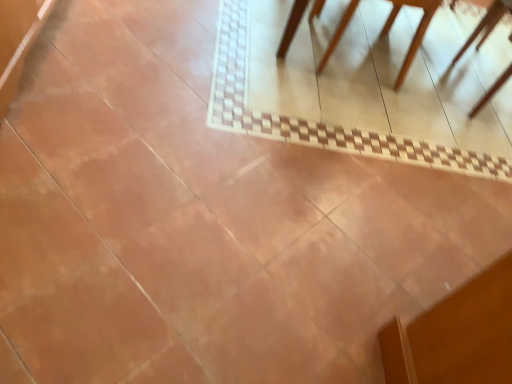
Question: From the image's perspective, is light brown wooden table at upper right positioned above or below brown wooden chair at upper right?

Choices:
 (A) below
 (B) above

Answer: (B)

Question: Is point (435, 6) positioned closer to the camera than point (501, 84)?

Choices:
 (A) farther
 (B) closer

Answer: (A)

Question: In terms of width, does light brown wooden table at upper right look wider or thinner when compared to brown wooden chair at upper right?

Choices:
 (A) thin
 (B) wide

Answer: (B)

Question: From the image's perspective, relative to light brown wooden table at upper right, is brown wooden chair at upper right above or below?

Choices:
 (A) above
 (B) below

Answer: (B)

Question: From a real-world perspective, is brown wooden chair at upper right physically located above or below light brown wooden table at upper right?

Choices:
 (A) below
 (B) above

Answer: (A)

Question: Considering their positions, is brown wooden chair at upper right located in front of or behind light brown wooden table at upper right?

Choices:
 (A) behind
 (B) front

Answer: (A)

Question: Would you say brown wooden chair at upper right is to the left or to the right of light brown wooden table at upper right in the picture?

Choices:
 (A) right
 (B) left

Answer: (A)